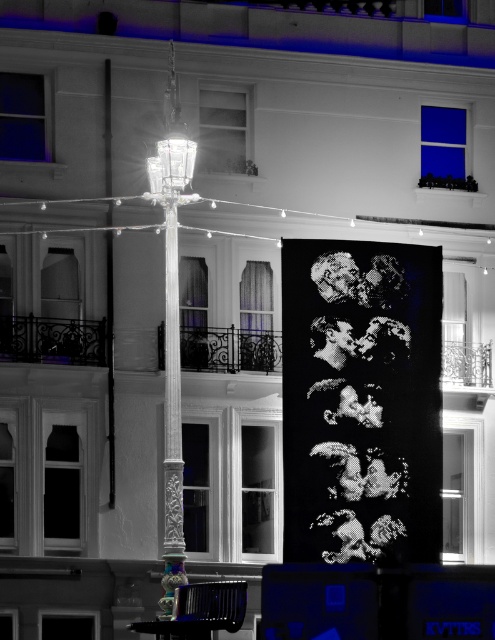
Question: Can you confirm if white glossy lamp post at center is positioned below silver metallic pole at center?

Choices:
 (A) yes
 (B) no

Answer: (B)

Question: Does white glossy lamp post at center have a greater width compared to silver metallic pole at center?

Choices:
 (A) yes
 (B) no

Answer: (A)

Question: Which point is farther from the camera taking this photo?

Choices:
 (A) click(168, 316)
 (B) click(169, 576)

Answer: (A)

Question: Can you confirm if white glossy lamp post at center is positioned above silver metallic pole at center?

Choices:
 (A) yes
 (B) no

Answer: (A)